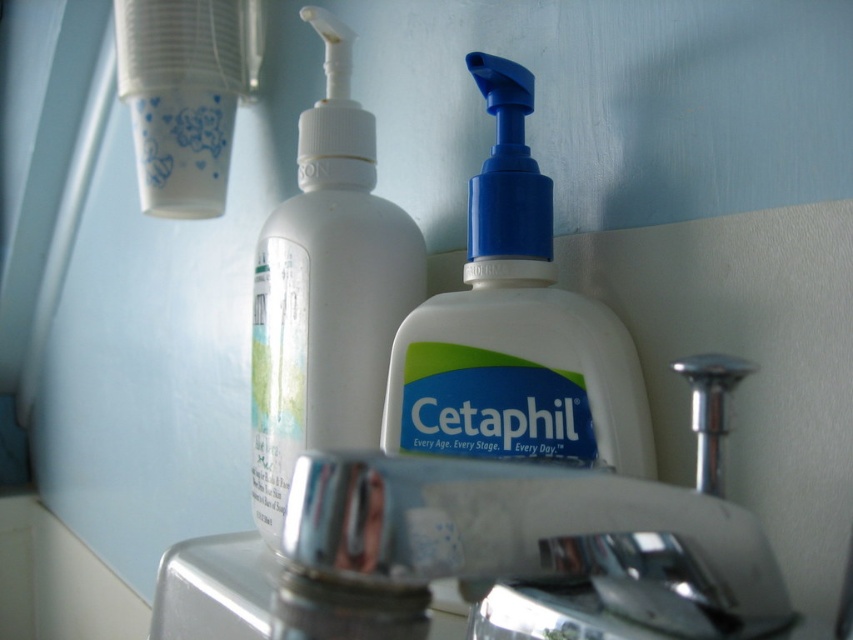
Does silver metallic faucet at center have a greater height compared to white plastic cetaphil soap dispenser at center?

In fact, silver metallic faucet at center may be shorter than white plastic cetaphil soap dispenser at center.

Is silver metallic faucet at center bigger than white plastic cetaphil soap dispenser at center?

Yes, silver metallic faucet at center is bigger than white plastic cetaphil soap dispenser at center.

This screenshot has width=853, height=640. Describe the element at coordinates (550, 528) in the screenshot. I see `silver metallic faucet at center` at that location.

Locate an element on the screen. The width and height of the screenshot is (853, 640). silver metallic faucet at center is located at coordinates (550, 528).

Is point (462, 307) closer to viewer compared to point (387, 294)?

Yes, point (462, 307) is in front of point (387, 294).

Can you confirm if white plastic cetaphil soap dispenser at center is positioned above white plastic bottle at center?

No.

This screenshot has width=853, height=640. What do you see at coordinates (515, 330) in the screenshot?
I see `white plastic cetaphil soap dispenser at center` at bounding box center [515, 330].

This screenshot has height=640, width=853. In order to click on white plastic cetaphil soap dispenser at center in this screenshot , I will do `click(515, 330)`.

Does silver metallic faucet at center appear over white plastic bottle at center?

No.

Between point (670, 541) and point (263, 429), which one is positioned in front?

Point (670, 541) is in front.

Locate an element on the screen. The height and width of the screenshot is (640, 853). silver metallic faucet at center is located at coordinates (550, 528).